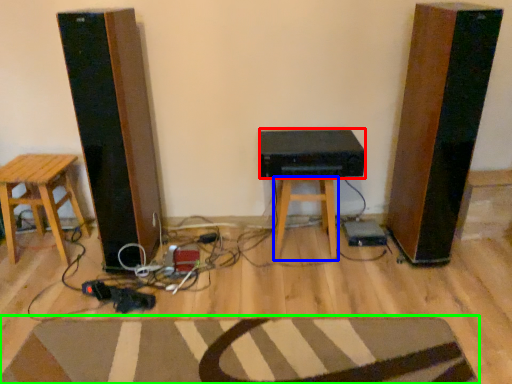
Question: Which object is the farthest from speaker (highlighted by a red box)? Choose among these: stool (highlighted by a blue box) or doormat (highlighted by a green box).

Choices:
 (A) stool
 (B) doormat

Answer: (B)